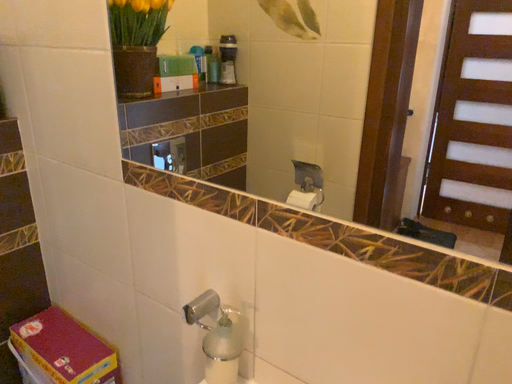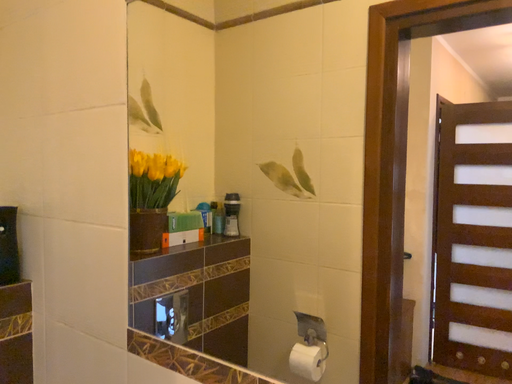
Question: Which way did the camera rotate in the video?

Choices:
 (A) rotated downward
 (B) rotated upward

Answer: (B)